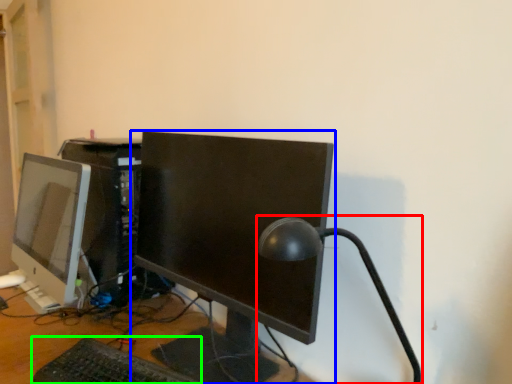
Question: Considering the real-world distances, which object is closest to table lamp (highlighted by a red box)? computer monitor (highlighted by a blue box) or computer keyboard (highlighted by a green box).

Choices:
 (A) computer monitor
 (B) computer keyboard

Answer: (A)